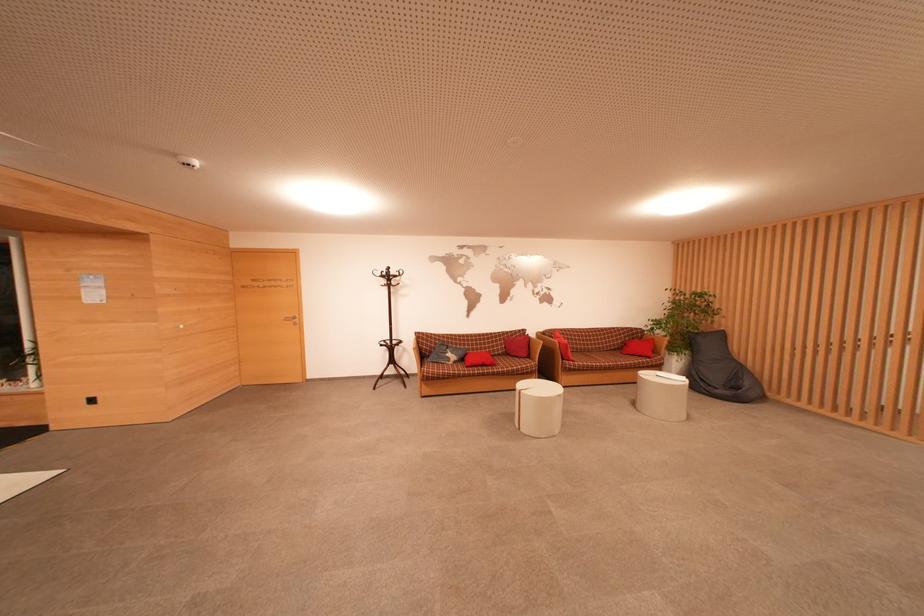
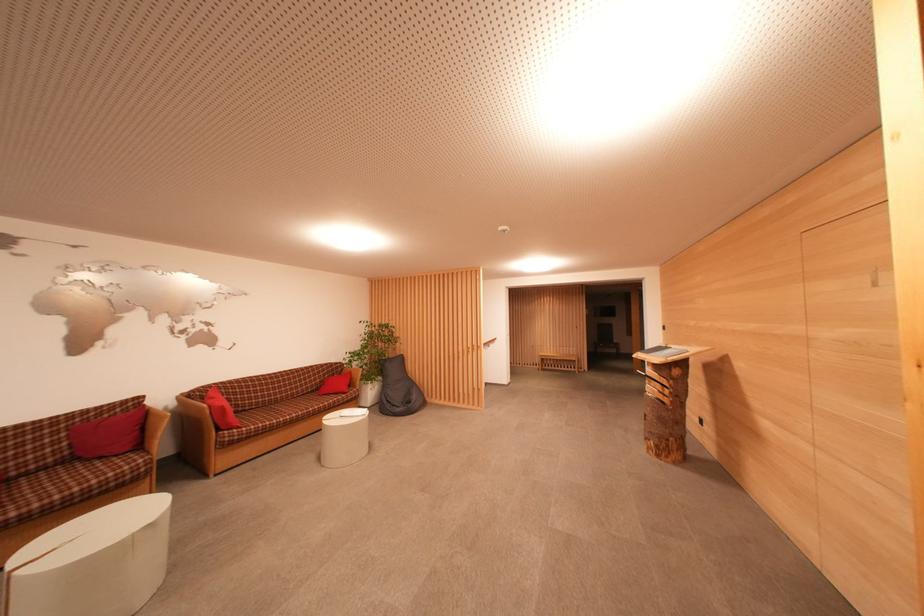
Locate, in the second image, the point that corresponds to (x=637, y=342) in the first image.

(337, 378)